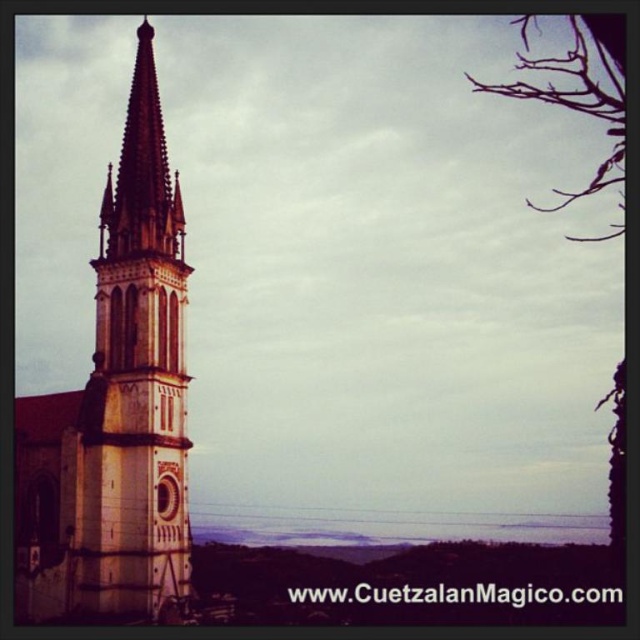
Question: Which of the following is the farthest from the observer?

Choices:
 (A) (118, 305)
 (B) (620, 204)

Answer: (B)

Question: Observing the image, what is the correct spatial positioning of white stone church at left in reference to brown/dry branches at upper right?

Choices:
 (A) right
 (B) left

Answer: (B)

Question: Does white stone church at left have a larger size compared to brown/dry branches at upper right?

Choices:
 (A) yes
 (B) no

Answer: (B)

Question: Which object appears closest to the camera in this image?

Choices:
 (A) brown/dry branches at upper right
 (B) white stone church at left

Answer: (A)

Question: Which of the following is the closest to the observer?

Choices:
 (A) (593, 33)
 (B) (104, 292)

Answer: (A)

Question: Can you confirm if white stone church at left is positioned to the right of brown/dry branches at upper right?

Choices:
 (A) no
 (B) yes

Answer: (A)